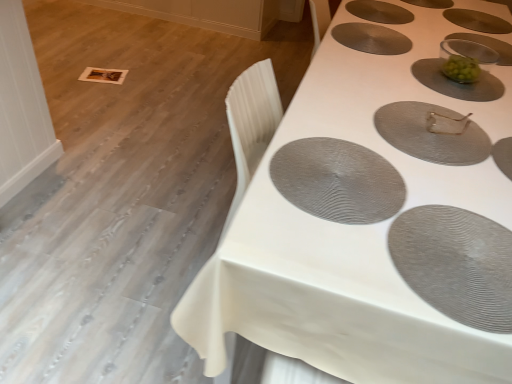
The image size is (512, 384). Identify the location of vacant space that is in between matte gray placemat at upper center, arranged as the third oval when viewed from the back, and matte gray placemat at center, which is the fifth oval in back-to-front order. (382, 80).